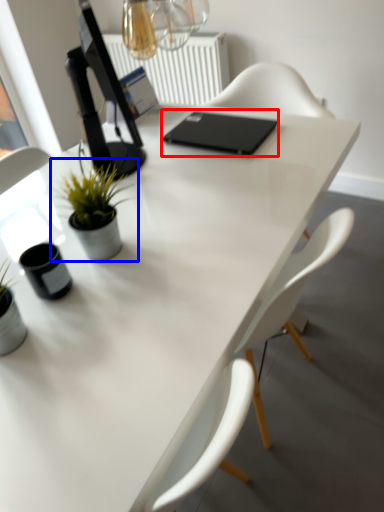
Question: Among these objects, which one is nearest to the camera, laptop (highlighted by a red box) or houseplant (highlighted by a blue box)?

Choices:
 (A) laptop
 (B) houseplant

Answer: (B)